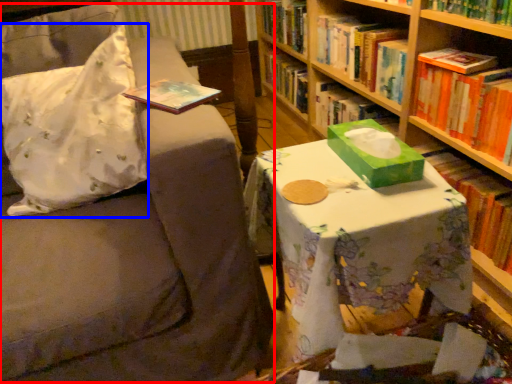
Question: Which object appears farthest to the camera in this image, swivel chair (highlighted by a red box) or throw pillow (highlighted by a blue box)?

Choices:
 (A) swivel chair
 (B) throw pillow

Answer: (B)